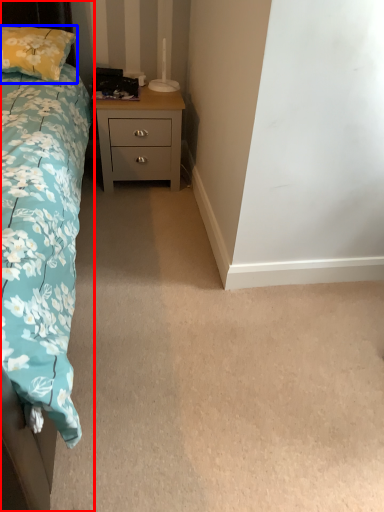
Question: Which object appears farthest to the camera in this image, bed (highlighted by a red box) or pillow (highlighted by a blue box)?

Choices:
 (A) bed
 (B) pillow

Answer: (B)